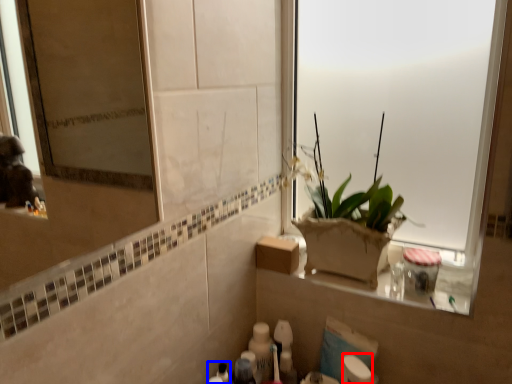
Question: Which of the following is the farthest to the observer, toilet paper (highlighted by a red box) or toiletry (highlighted by a blue box)?

Choices:
 (A) toilet paper
 (B) toiletry

Answer: (B)